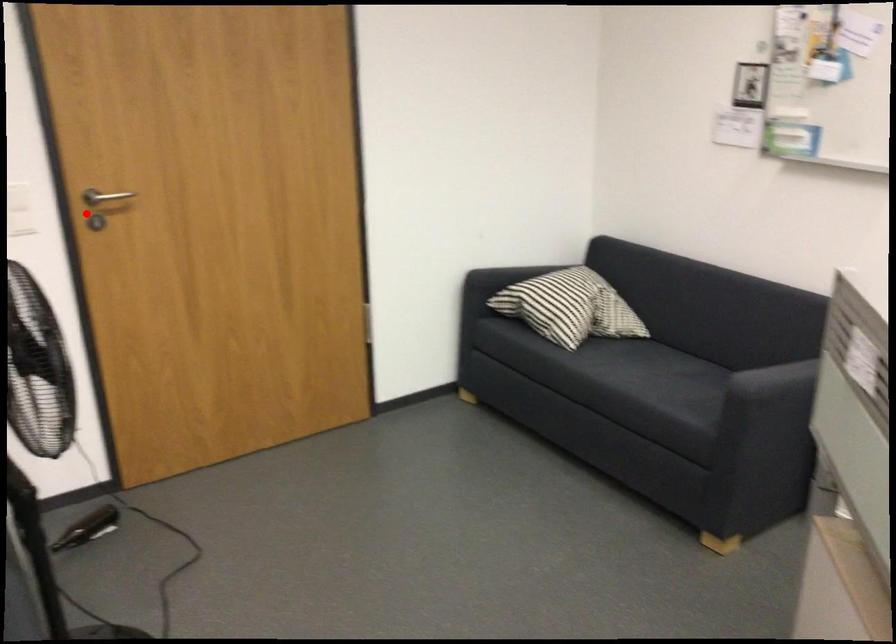
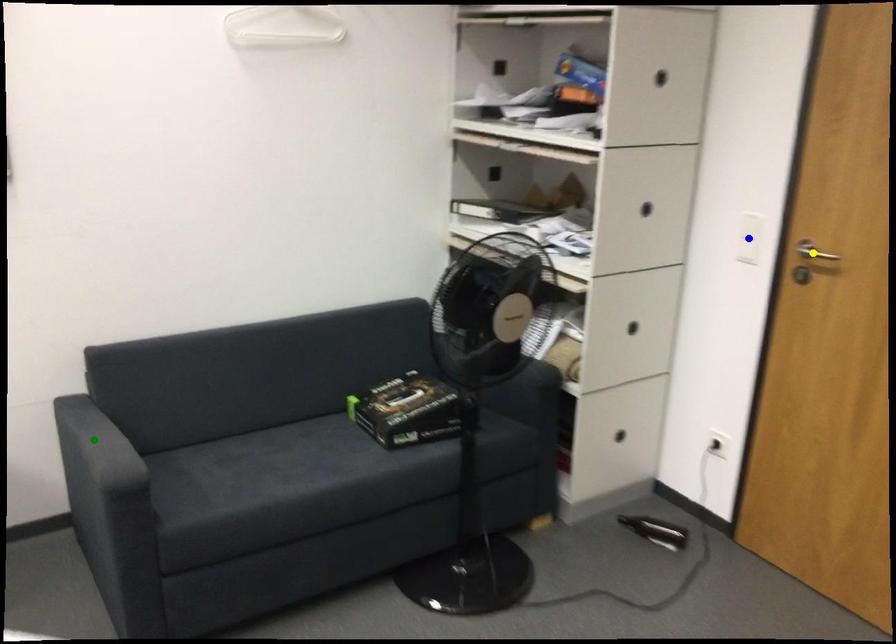
Question: I am providing you with two images of the same scene from different viewpoints. A red point is marked on the first image. You are given multiple points on the second image. In image 2, which mark is for the same physical point as the one in image 1?

Choices:
 (A) blue point
 (B) yellow point
 (C) green point

Answer: (B)